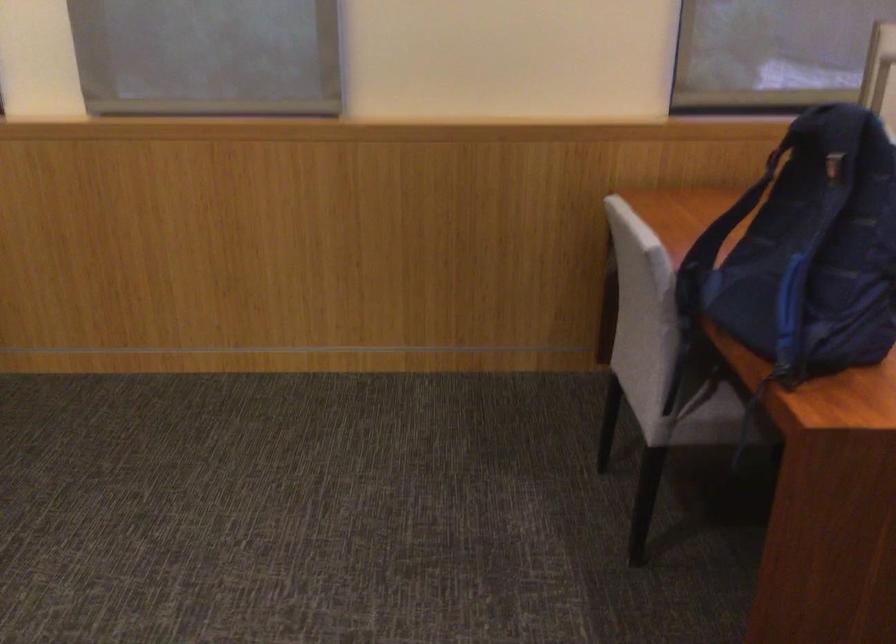
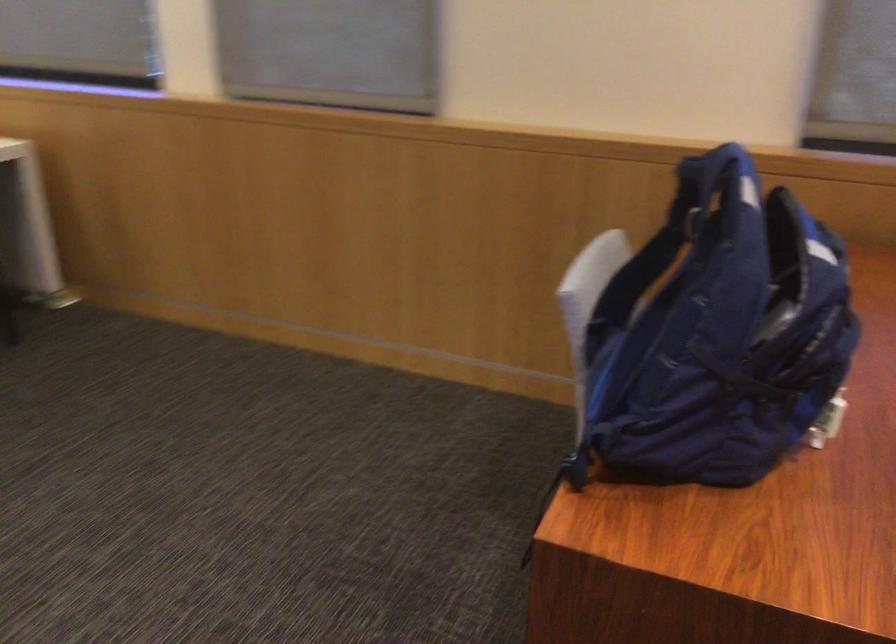
The point at (823, 160) is marked in the first image. Where is the corresponding point in the second image?

(687, 216)